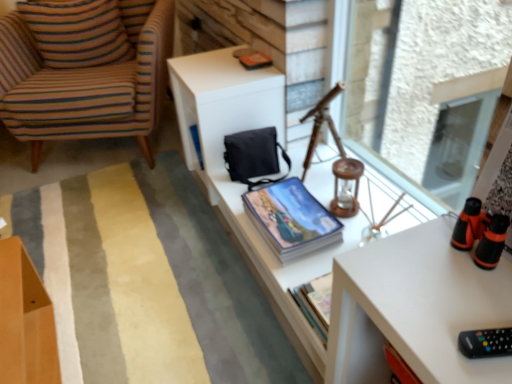
Question: Is soft striped rug at center taller or shorter than striped fabric pillow at left?

Choices:
 (A) tall
 (B) short

Answer: (B)

Question: Considering the positions of soft striped rug at center and striped fabric pillow at left in the image, is soft striped rug at center bigger or smaller than striped fabric pillow at left?

Choices:
 (A) small
 (B) big

Answer: (B)

Question: Which of these objects is positioned closest to the black plastic remote at lower right?

Choices:
 (A) soft striped rug at center
 (B) striped fabric armchair at left
 (C) striped fabric pillow at left
 (D) blue glossy book at center
 (E) transparent glass window screen at upper right

Answer: (D)

Question: Estimate the real-world distances between objects in this image. Which object is closer to the blue glossy book at center?

Choices:
 (A) transparent glass window screen at upper right
 (B) soft striped rug at center
 (C) matte blue magazine at upper center
 (D) white matte table at center
 (E) striped fabric pillow at left

Answer: (D)